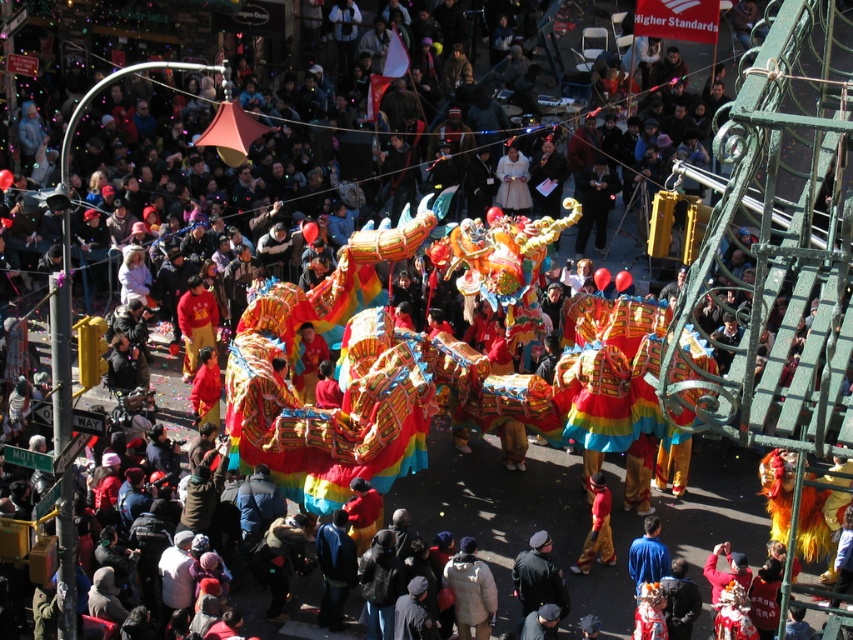
Question: Is white cotton jacket at center thinner than dark blue uniform at center?

Choices:
 (A) no
 (B) yes

Answer: (B)

Question: Is the position of dark blue uniform at center more distant than that of red fabric pants at lower center?

Choices:
 (A) no
 (B) yes

Answer: (A)

Question: Among these objects, which one is farthest from the camera?

Choices:
 (A) dark blue uniform at center
 (B) red fabric pants at lower center
 (C) white cotton jacket at center

Answer: (B)

Question: Which is farther from the dark blue uniform at center?

Choices:
 (A) red fabric pants at lower center
 (B) white cotton jacket at center

Answer: (A)

Question: Is white cotton jacket at center positioned in front of dark blue uniform at center?

Choices:
 (A) yes
 (B) no

Answer: (B)

Question: Which is farther from the red fabric pants at lower center?

Choices:
 (A) dark blue uniform at center
 (B) white cotton jacket at center

Answer: (B)